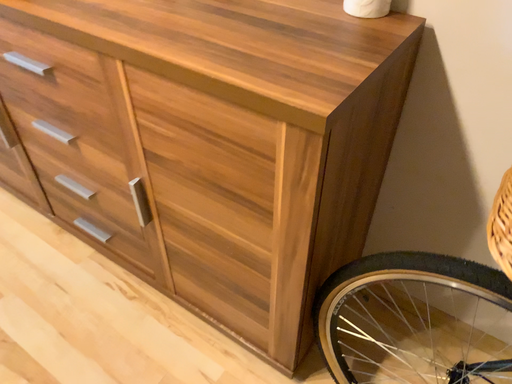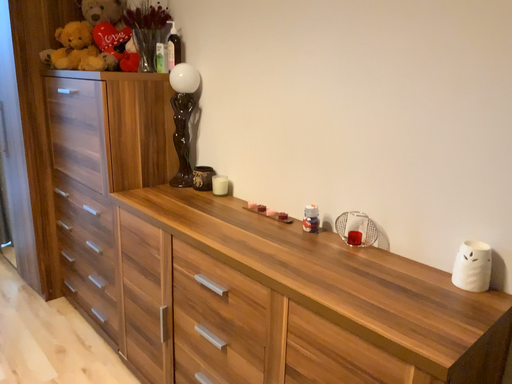
Question: Which way did the camera rotate in the video?

Choices:
 (A) rotated downward
 (B) rotated upward

Answer: (B)